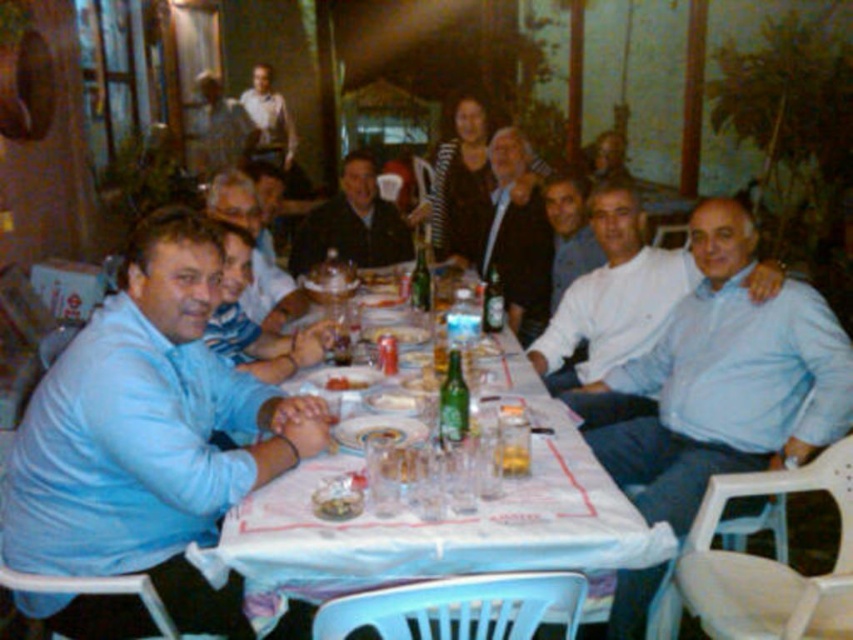
Does point (404, 252) come behind point (279, 301)?

Yes.

Is point (370, 266) positioned in front of point (244, 209)?

That is False.

Between point (357, 243) and point (279, 310), which one is positioned in front?

Point (279, 310)

Image resolution: width=853 pixels, height=640 pixels. Find the location of `dark blue shirt at center`. dark blue shirt at center is located at coordinates point(352,225).

Who is positioned more to the right, white shirt at center or striped fabric shirt at center?

white shirt at center

Does white shirt at center have a lesser width compared to striped fabric shirt at center?

Incorrect, white shirt at center's width is not less than striped fabric shirt at center's.

Is point (567, 288) farther from viewer compared to point (461, 244)?

No, (567, 288) is in front of (461, 244).

Locate an element on the screen. white shirt at center is located at coordinates (611, 307).

Does blue shirt at left have a smaller size compared to white glossy plate at table center?

Actually, blue shirt at left might be larger than white glossy plate at table center.

Is point (294, 310) closer to viewer compared to point (334, 390)?

No, it is behind (334, 390).

Who is more forward, (238,193) or (354,378)?

Positioned in front is point (354,378).

You are a GUI agent. You are given a task and a screenshot of the screen. Output one action in this format:
    pyautogui.click(x=<x>, y=<y>)
    Task: Click on the blue shirt at left
    The width and height of the screenshot is (853, 640).
    Given the screenshot: What is the action you would take?
    pyautogui.click(x=271, y=294)